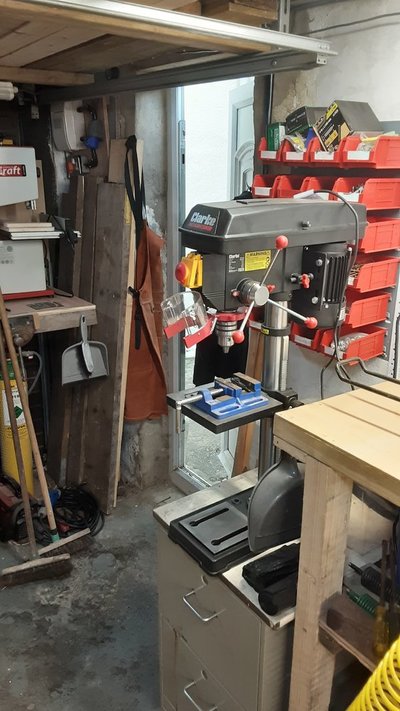
Locate an element on the screen. door frame is located at coordinates (181, 169).